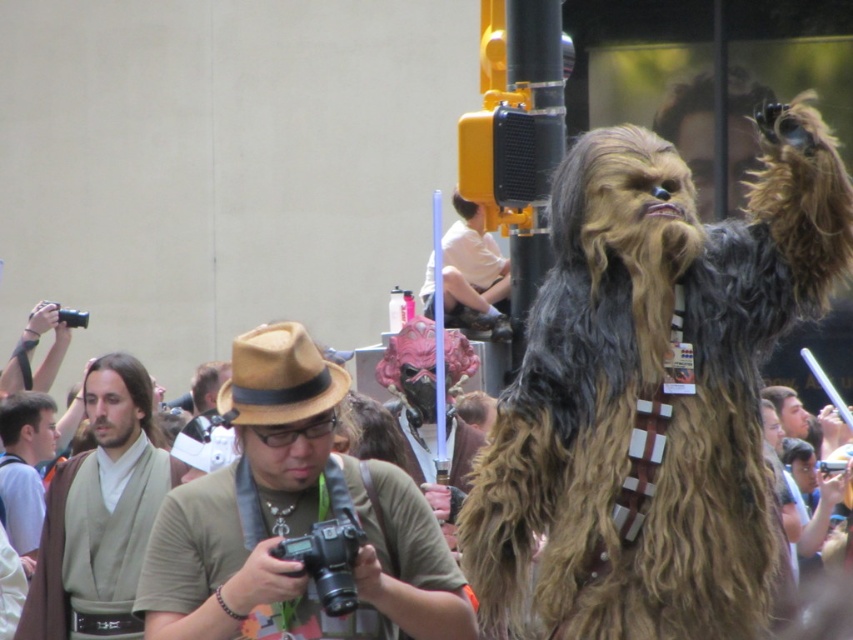
Does white cotton shirt at center have a greater height compared to light brown fabric robe at center?

Correct, white cotton shirt at center is much taller as light brown fabric robe at center.

From the picture: Between white cotton shirt at center and light brown fabric robe at center, which one is positioned lower?

light brown fabric robe at center is lower down.

Image resolution: width=853 pixels, height=640 pixels. What are the coordinates of `white cotton shirt at center` in the screenshot? It's located at (473, 275).

Which is behind, point (567, 595) or point (248, 518)?

The point (248, 518) is behind.

Identify the location of fuzzy brown fur at center. The image size is (853, 640). (653, 390).

Can you confirm if fuzzy brown fur at center is positioned above white cotton shirt at center?

Yes.

Locate an element on the screen. fuzzy brown fur at center is located at coordinates (653, 390).